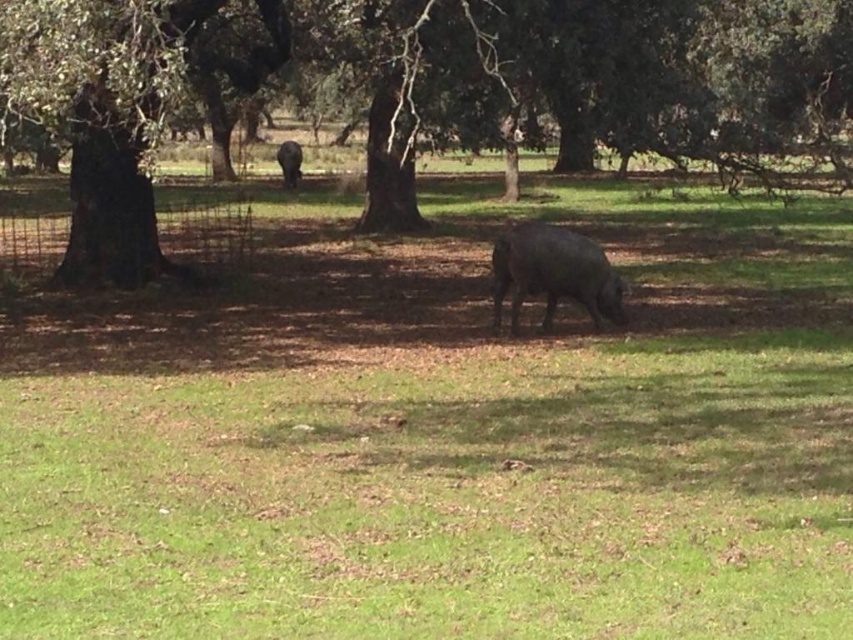
Which is behind, point (155, 243) or point (518, 234)?

Positioned behind is point (155, 243).

Does brown rough tree at left have a smaller size compared to black matte pig at center?

Incorrect, brown rough tree at left is not smaller in size than black matte pig at center.

Measure the distance between brown rough tree at left and camera.

brown rough tree at left and camera are 27.24 feet apart.

Locate an element on the screen. The height and width of the screenshot is (640, 853). brown rough tree at left is located at coordinates (428, 92).

Is brown rough tree at left closer to camera compared to dark gray matte pig at center?

Yes, brown rough tree at left is closer to the viewer.

Who is higher up, brown rough tree at left or dark gray matte pig at center?

Positioned higher is dark gray matte pig at center.

Identify the location of brown rough tree at left. (428, 92).

Image resolution: width=853 pixels, height=640 pixels. Identify the location of brown rough tree at left. (428, 92).

You are a GUI agent. You are given a task and a screenshot of the screen. Output one action in this format:
    pyautogui.click(x=<x>, y=<y>)
    Task: Click on the brown rough tree at left
    The width and height of the screenshot is (853, 640).
    Given the screenshot: What is the action you would take?
    pyautogui.click(x=428, y=92)

Between brown rough tree at left and dark brown bark at left, which one appears on the left side from the viewer's perspective?

dark brown bark at left

Measure the distance between point (726, 4) and camera.

Point (726, 4) and camera are 26.21 meters apart from each other.

Where is `brown rough tree at left`? The width and height of the screenshot is (853, 640). brown rough tree at left is located at coordinates (428, 92).